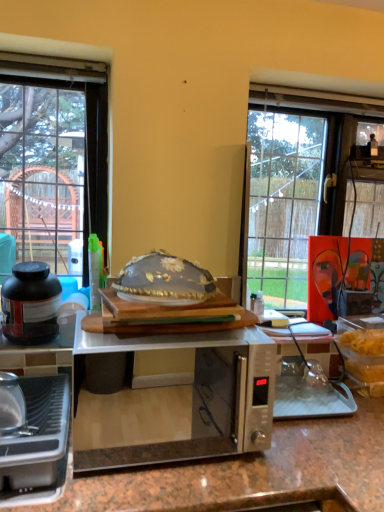
Find the location of a particular element. translucent glass bowl at center is located at coordinates (164, 280).

The height and width of the screenshot is (512, 384). What do you see at coordinates (164, 280) in the screenshot?
I see `translucent glass bowl at center` at bounding box center [164, 280].

Where is `satin silver microwave at center`? satin silver microwave at center is located at coordinates (173, 398).

Between matte black jar at left, the 1th kitchen appliance from the back, and translucent glass bowl at center, which one has more height?

With more height is matte black jar at left, the 1th kitchen appliance from the back.

Would you say matte black jar at left, the 1th kitchen appliance from the back, is outside translucent glass bowl at center?

That's correct, matte black jar at left, the 1th kitchen appliance from the back, is outside of translucent glass bowl at center.

Which of these two, matte black jar at left, the 1th kitchen appliance from the back, or translucent glass bowl at center, is bigger?

With larger size is translucent glass bowl at center.

Between matte black jar at left, the 2th kitchen appliance viewed from the front, and translucent glass bowl at center, which one has smaller width?

matte black jar at left, the 2th kitchen appliance viewed from the front.

Does translucent glass bowl at center have a lesser height compared to metallic silver toaster at lower left, the first kitchen appliance when ordered from front to back?

Correct, translucent glass bowl at center is not as tall as metallic silver toaster at lower left, the first kitchen appliance when ordered from front to back.

Between translucent glass bowl at center and metallic silver toaster at lower left, the second kitchen appliance in the back-to-front sequence, which one has smaller width?

Thinner between the two is translucent glass bowl at center.

Is point (170, 258) farther from camera compared to point (31, 392)?

No, it is in front of (31, 392).

In the image, is translucent glass bowl at center positioned in front of or behind metallic silver toaster at lower left, acting as the 2th kitchen appliance starting from the top?

Clearly, translucent glass bowl at center is behind metallic silver toaster at lower left, acting as the 2th kitchen appliance starting from the top.

Which is closer, (63, 473) or (166, 294)?

Point (63, 473) is closer to the camera than point (166, 294).

Is metallic silver toaster at lower left, the second kitchen appliance in the back-to-front sequence, oriented away from translucent glass bowl at center?

No, metallic silver toaster at lower left, the second kitchen appliance in the back-to-front sequence, is not facing away from translucent glass bowl at center.

From the picture: Between metallic silver toaster at lower left, the second kitchen appliance in the back-to-front sequence, and translucent glass bowl at center, which one has less height?

Standing shorter between the two is translucent glass bowl at center.

From a real-world perspective, is metallic silver toaster at lower left, the first kitchen appliance when ordered from front to back, on top of translucent glass bowl at center?

No, from a real-world perspective, metallic silver toaster at lower left, the first kitchen appliance when ordered from front to back, is not above translucent glass bowl at center.

Find the location of a particular element. food above the matte black jar at left, placed as the 1th kitchen appliance when sorted from top to bottom (from the image's perspective) is located at coordinates (164, 280).

Can you tell me how much translucent glass bowl at center and matte black jar at left, the 2th kitchen appliance positioned from the bottom, differ in facing direction?

4.71 degrees.

Based on the photo, would you say translucent glass bowl at center is a long distance from matte black jar at left, the 2th kitchen appliance viewed from the front?

No, translucent glass bowl at center is not far away from matte black jar at left, the 2th kitchen appliance viewed from the front.

Is translucent glass bowl at center outside of matte black jar at left, the 2th kitchen appliance positioned from the bottom?

translucent glass bowl at center lies outside matte black jar at left, the 2th kitchen appliance positioned from the bottom,'s area.

From the picture: From the image's perspective, relative to satin silver microwave at center, is metallic silver toaster at lower left, the second kitchen appliance in the back-to-front sequence, above or below?

metallic silver toaster at lower left, the second kitchen appliance in the back-to-front sequence, is below satin silver microwave at center.

Is metallic silver toaster at lower left, acting as the 2th kitchen appliance starting from the top, situated inside satin silver microwave at center or outside?

metallic silver toaster at lower left, acting as the 2th kitchen appliance starting from the top, is located beyond the bounds of satin silver microwave at center.

Which point is more forward, (57, 394) or (194, 421)?

The point (57, 394) is more forward.

Image resolution: width=384 pixels, height=512 pixels. Identify the location of microwave oven above the metallic silver toaster at lower left, acting as the 2th kitchen appliance starting from the top (from the image's perspective). (173, 398).

In the image, is translucent glass bowl at center positioned in front of or behind satin silver microwave at center?

Clearly, translucent glass bowl at center is behind satin silver microwave at center.

Looking at the image, does translucent glass bowl at center seem bigger or smaller compared to satin silver microwave at center?

Clearly, translucent glass bowl at center is smaller in size than satin silver microwave at center.

Is translucent glass bowl at center spatially inside satin silver microwave at center, or outside of it?

translucent glass bowl at center cannot be found inside satin silver microwave at center.

Considering the positions of points (192, 263) and (122, 436), is point (192, 263) farther from camera compared to point (122, 436)?

That is False.

Could you tell me if matte black jar at left, the 1th kitchen appliance from the back, is turned towards metallic silver toaster at lower left, acting as the first kitchen appliance starting from the bottom?

Yes, matte black jar at left, the 1th kitchen appliance from the back, is facing metallic silver toaster at lower left, acting as the first kitchen appliance starting from the bottom.

Is matte black jar at left, the 2th kitchen appliance positioned from the bottom, to the right of metallic silver toaster at lower left, the first kitchen appliance when ordered from front to back, from the viewer's perspective?

No.

Find the location of `kitchen appliance below the matte black jar at left, the 2th kitchen appliance positioned from the bottom (from the image's perspective)`. kitchen appliance below the matte black jar at left, the 2th kitchen appliance positioned from the bottom (from the image's perspective) is located at coordinates (38, 445).

I want to click on food in front of the matte black jar at left, the 1th kitchen appliance from the back, so pyautogui.click(x=164, y=280).

Locate an element on the screen. The height and width of the screenshot is (512, 384). kitchen appliance that is the 1st one when counting leftward from the translucent glass bowl at center is located at coordinates (38, 445).

Based on their spatial positions, is metallic silver toaster at lower left, the first kitchen appliance when ordered from front to back, or satin silver microwave at center closer to matte black jar at left, the 2th kitchen appliance viewed from the front?

metallic silver toaster at lower left, the first kitchen appliance when ordered from front to back, is closer to matte black jar at left, the 2th kitchen appliance viewed from the front.

From the image, which object appears to be farther from matte black jar at left, the 2th kitchen appliance viewed from the front, metallic silver toaster at lower left, the second kitchen appliance in the back-to-front sequence, or translucent glass bowl at center?

The object further to matte black jar at left, the 2th kitchen appliance viewed from the front, is translucent glass bowl at center.

When comparing their distances from translucent glass bowl at center, does metallic silver toaster at lower left, acting as the first kitchen appliance starting from the bottom, or satin silver microwave at center seem further?

satin silver microwave at center.

Based on their spatial positions, is matte black jar at left, the 2th kitchen appliance positioned from the bottom, or metallic silver toaster at lower left, acting as the 2th kitchen appliance starting from the top, closer to translucent glass bowl at center?

metallic silver toaster at lower left, acting as the 2th kitchen appliance starting from the top.

Considering their positions, is metallic silver toaster at lower left, the first kitchen appliance when ordered from front to back, positioned closer to satin silver microwave at center than matte black jar at left, placed as the 1th kitchen appliance when sorted from top to bottom?

matte black jar at left, placed as the 1th kitchen appliance when sorted from top to bottom.

Based on the photo, from the image, which object appears to be nearer to matte black jar at left, the 1th kitchen appliance from the back, satin silver microwave at center or translucent glass bowl at center?

translucent glass bowl at center is positioned closer to the anchor matte black jar at left, the 1th kitchen appliance from the back.

Consider the image. From the image, which object appears to be nearer to satin silver microwave at center, metallic silver toaster at lower left, the first kitchen appliance when ordered from front to back, or translucent glass bowl at center?

metallic silver toaster at lower left, the first kitchen appliance when ordered from front to back.

From the image, which object appears to be farther from metallic silver toaster at lower left, the first kitchen appliance when ordered from front to back, matte black jar at left, placed as the 1th kitchen appliance when sorted from top to bottom, or translucent glass bowl at center?

translucent glass bowl at center is further to metallic silver toaster at lower left, the first kitchen appliance when ordered from front to back.

I want to click on microwave oven between translucent glass bowl at center and metallic silver toaster at lower left, the first kitchen appliance when ordered from front to back, vertically, so click(173, 398).

I want to click on food between matte black jar at left, placed as the 1th kitchen appliance when sorted from top to bottom, and satin silver microwave at center from left to right, so click(x=164, y=280).

Where is `microwave oven between metallic silver toaster at lower left, acting as the 2th kitchen appliance starting from the top, and matte black jar at left, the 2th kitchen appliance positioned from the bottom, in the front-back direction`? The width and height of the screenshot is (384, 512). microwave oven between metallic silver toaster at lower left, acting as the 2th kitchen appliance starting from the top, and matte black jar at left, the 2th kitchen appliance positioned from the bottom, in the front-back direction is located at coordinates (173, 398).

This screenshot has width=384, height=512. Find the location of `kitchen appliance situated between matte black jar at left, the 2th kitchen appliance positioned from the bottom, and translucent glass bowl at center from left to right`. kitchen appliance situated between matte black jar at left, the 2th kitchen appliance positioned from the bottom, and translucent glass bowl at center from left to right is located at coordinates (38, 445).